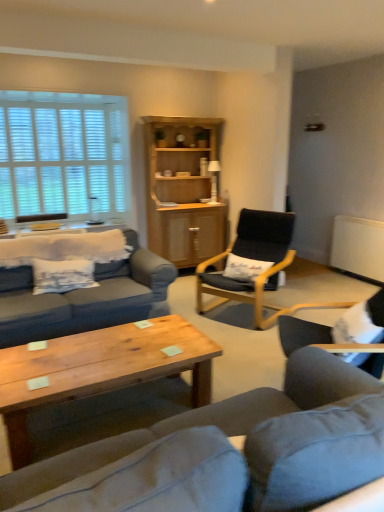
Question: Is white wooden blinds at upper left positioned far away from wooden table at left?

Choices:
 (A) yes
 (B) no

Answer: (B)

Question: Does white wooden blinds at upper left have a larger size compared to wooden table at left?

Choices:
 (A) no
 (B) yes

Answer: (B)

Question: Can you confirm if white wooden blinds at upper left is wider than wooden table at left?

Choices:
 (A) no
 (B) yes

Answer: (A)

Question: Does white wooden blinds at upper left appear on the right side of wooden table at left?

Choices:
 (A) no
 (B) yes

Answer: (A)

Question: From the image's perspective, is white wooden blinds at upper left on wooden table at left?

Choices:
 (A) no
 (B) yes

Answer: (B)

Question: Based on their positions, is matte gray couch at center located to the left or right of white wooden blinds at upper left?

Choices:
 (A) left
 (B) right

Answer: (B)

Question: Considering the positions of matte gray couch at center and white wooden blinds at upper left in the image, is matte gray couch at center bigger or smaller than white wooden blinds at upper left?

Choices:
 (A) small
 (B) big

Answer: (B)

Question: Is matte gray couch at center in front of or behind white wooden blinds at upper left in the image?

Choices:
 (A) front
 (B) behind

Answer: (A)

Question: In terms of width, does matte gray couch at center look wider or thinner when compared to white wooden blinds at upper left?

Choices:
 (A) wide
 (B) thin

Answer: (A)

Question: From a real-world perspective, is black fabric chair at center, the 1th chair positioned from the back, physically located above or below white fabric pillow at center?

Choices:
 (A) above
 (B) below

Answer: (A)

Question: Considering the positions of black fabric chair at center, the 1th chair positioned from the back, and white fabric pillow at center in the image, is black fabric chair at center, the 1th chair positioned from the back, wider or thinner than white fabric pillow at center?

Choices:
 (A) wide
 (B) thin

Answer: (A)

Question: Considering the positions of point (225, 301) and point (228, 265), is point (225, 301) closer or farther from the camera than point (228, 265)?

Choices:
 (A) farther
 (B) closer

Answer: (A)

Question: From the image's perspective, relative to white fabric pillow at center, is black fabric chair at center, the 1th chair positioned from the back, above or below?

Choices:
 (A) below
 (B) above

Answer: (B)

Question: In the image, is matte gray couch at center on the left side or the right side of black fabric chair at center, the 1th chair positioned from the back?

Choices:
 (A) right
 (B) left

Answer: (B)

Question: Is matte gray couch at center in front of or behind black fabric chair at center, the 1th chair positioned from the back, in the image?

Choices:
 (A) behind
 (B) front

Answer: (B)